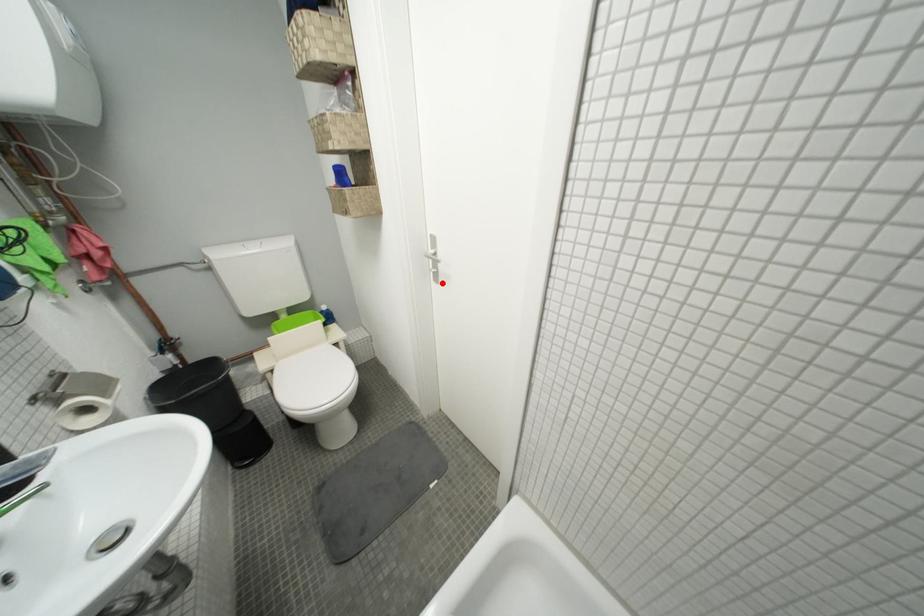
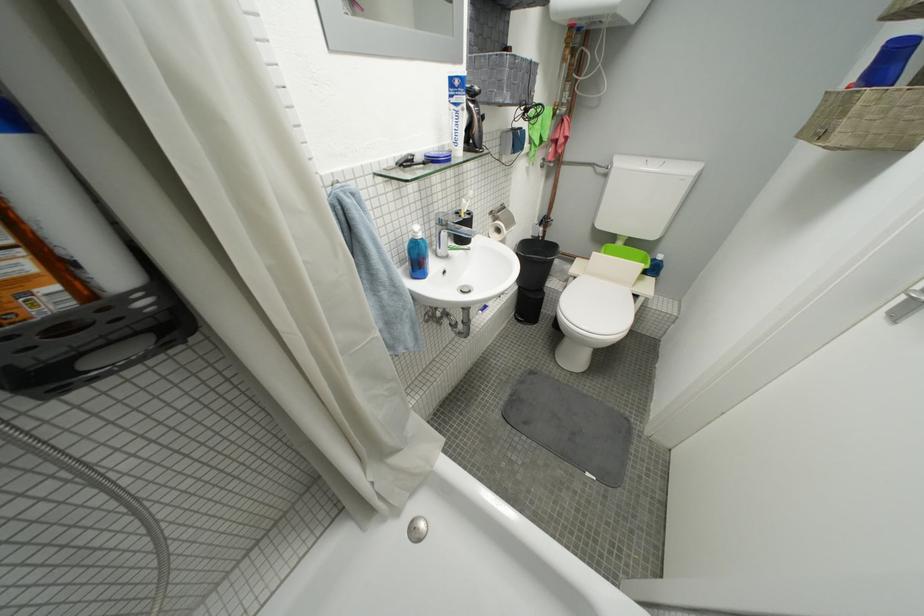
Find the pixel in the second image that matches the highlighted location in the first image.

(900, 315)